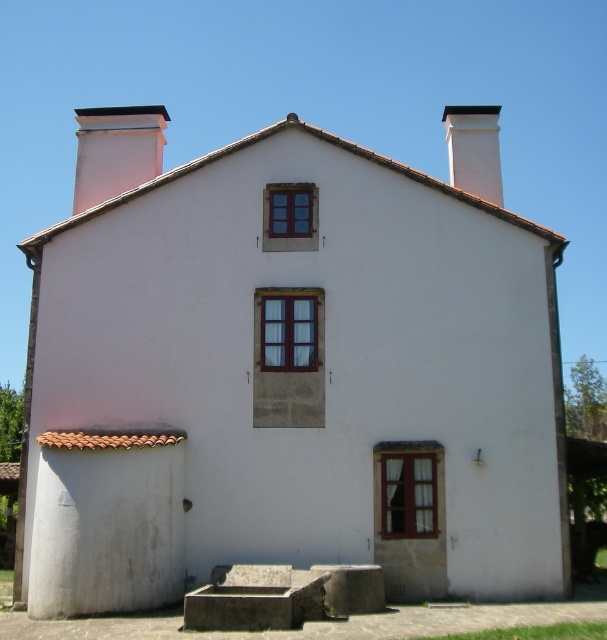
Question: Can you confirm if white smooth chimney at upper left is positioned to the left of white smooth chimney at upper center?

Choices:
 (A) yes
 (B) no

Answer: (A)

Question: Is white smooth chimney at upper left positioned before white smooth chimney at upper center?

Choices:
 (A) no
 (B) yes

Answer: (A)

Question: Can you confirm if white smooth chimney at upper left is bigger than white smooth chimney at upper center?

Choices:
 (A) yes
 (B) no

Answer: (A)

Question: Which object appears farthest from the camera in this image?

Choices:
 (A) white smooth chimney at upper left
 (B) white smooth chimney at upper center

Answer: (A)

Question: Which point appears farthest from the camera in this image?

Choices:
 (A) (492, 164)
 (B) (127, 108)

Answer: (B)